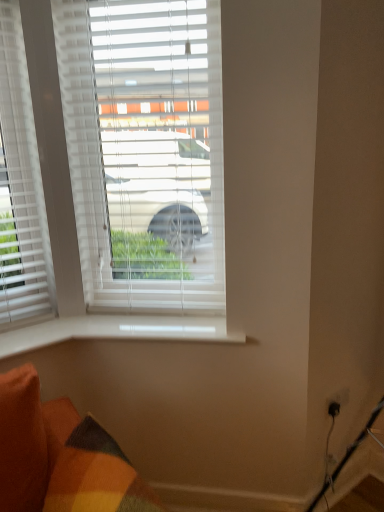
Question: Can you confirm if white smooth window sill at lower center is positioned to the left of white plastic blinds at center?

Choices:
 (A) no
 (B) yes

Answer: (A)

Question: Is the depth of white smooth window sill at lower center less than that of white plastic blinds at center?

Choices:
 (A) yes
 (B) no

Answer: (B)

Question: Can you confirm if white smooth window sill at lower center is smaller than white plastic blinds at center?

Choices:
 (A) yes
 (B) no

Answer: (A)

Question: From a real-world perspective, is white smooth window sill at lower center on top of white plastic blinds at center?

Choices:
 (A) no
 (B) yes

Answer: (A)

Question: Does white smooth window sill at lower center have a lesser height compared to white plastic blinds at center?

Choices:
 (A) yes
 (B) no

Answer: (A)

Question: Is white plastic blinds at center at the back of white smooth window sill at lower center?

Choices:
 (A) yes
 (B) no

Answer: (B)

Question: Does white plastic blinds at center appear on the left side of white smooth window sill at lower center?

Choices:
 (A) no
 (B) yes

Answer: (B)

Question: Can you confirm if white plastic blinds at center is shorter than white smooth window sill at lower center?

Choices:
 (A) no
 (B) yes

Answer: (A)

Question: From a real-world perspective, is white plastic blinds at center below white smooth window sill at lower center?

Choices:
 (A) yes
 (B) no

Answer: (B)

Question: Is white plastic blinds at center positioned far away from white smooth window sill at lower center?

Choices:
 (A) yes
 (B) no

Answer: (B)

Question: From the image's perspective, is white plastic blinds at center on top of white smooth window sill at lower center?

Choices:
 (A) no
 (B) yes

Answer: (B)

Question: Considering the relative sizes of white plastic blinds at center and white smooth window sill at lower center in the image provided, is white plastic blinds at center wider than white smooth window sill at lower center?

Choices:
 (A) yes
 (B) no

Answer: (B)

Question: In the image, is white smooth window sill at lower center on the left side or the right side of white plastic blinds at center?

Choices:
 (A) left
 (B) right

Answer: (B)